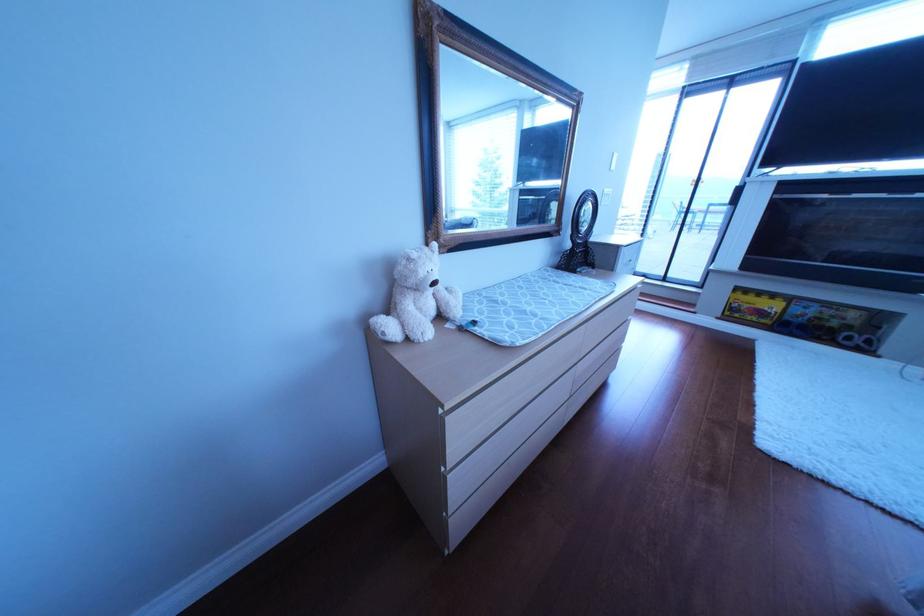
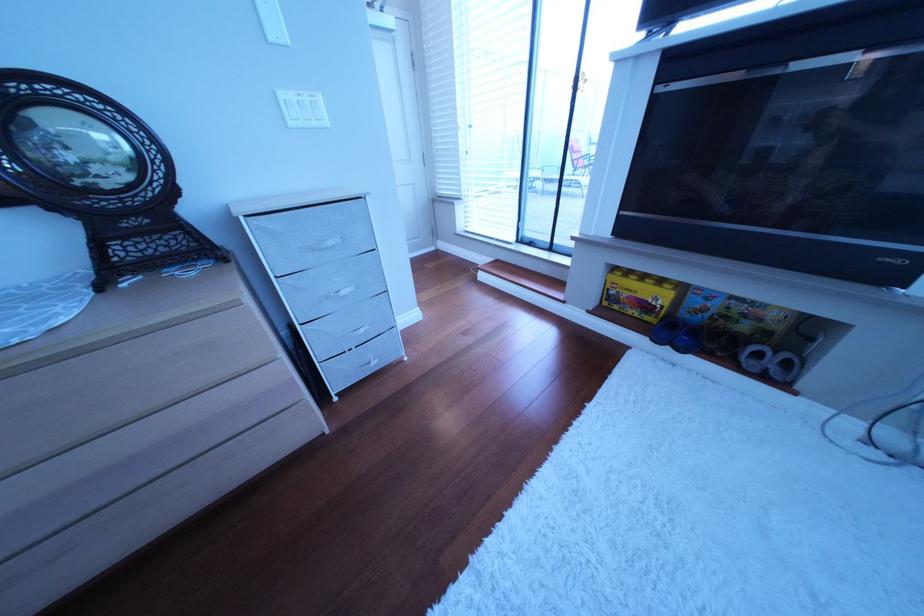
Find the pixel in the second image that matches (x=617, y=206) in the first image.

(307, 126)